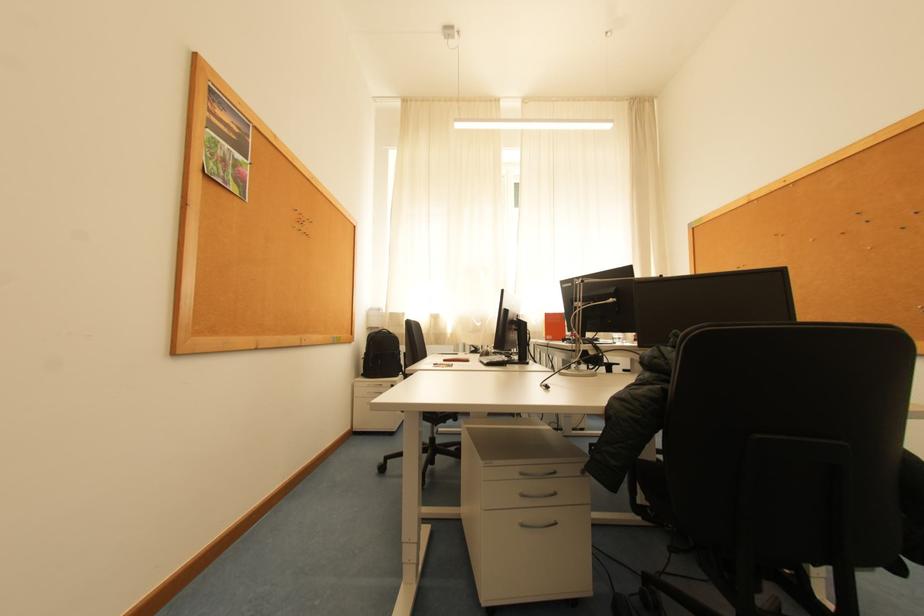
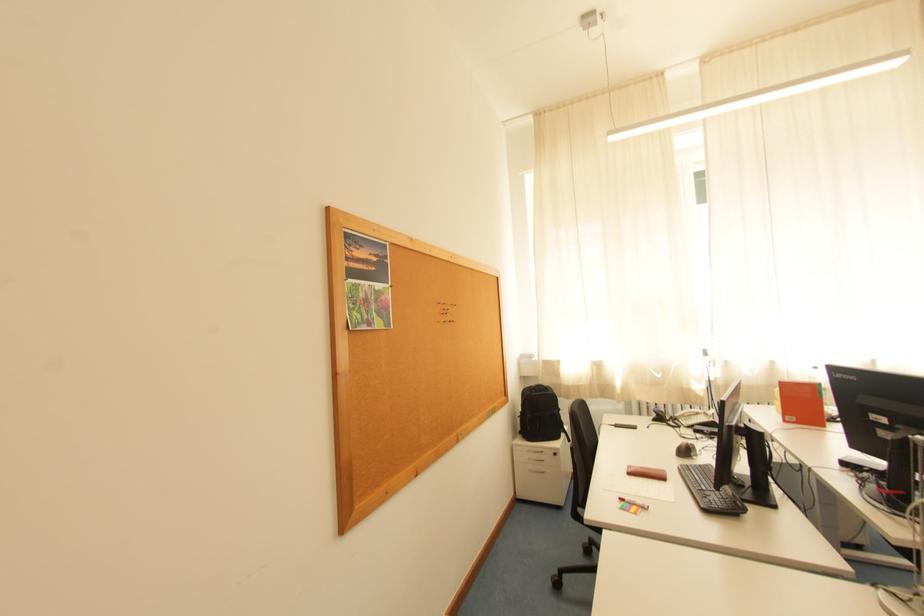
Find the pixel in the second image that matches [494,363] in the first image.

(711, 508)